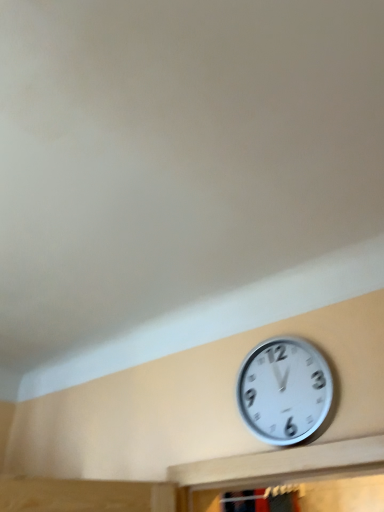
This screenshot has width=384, height=512. I want to click on white metallic wall clock at lower right, so click(x=284, y=390).

What do you see at coordinates (284, 390) in the screenshot? The height and width of the screenshot is (512, 384). I see `white metallic wall clock at lower right` at bounding box center [284, 390].

You are a GUI agent. You are given a task and a screenshot of the screen. Output one action in this format:
    pyautogui.click(x=<x>, y=<y>)
    Task: Click on the white metallic wall clock at lower right
    The image size is (384, 512).
    Given the screenshot: What is the action you would take?
    coord(284,390)